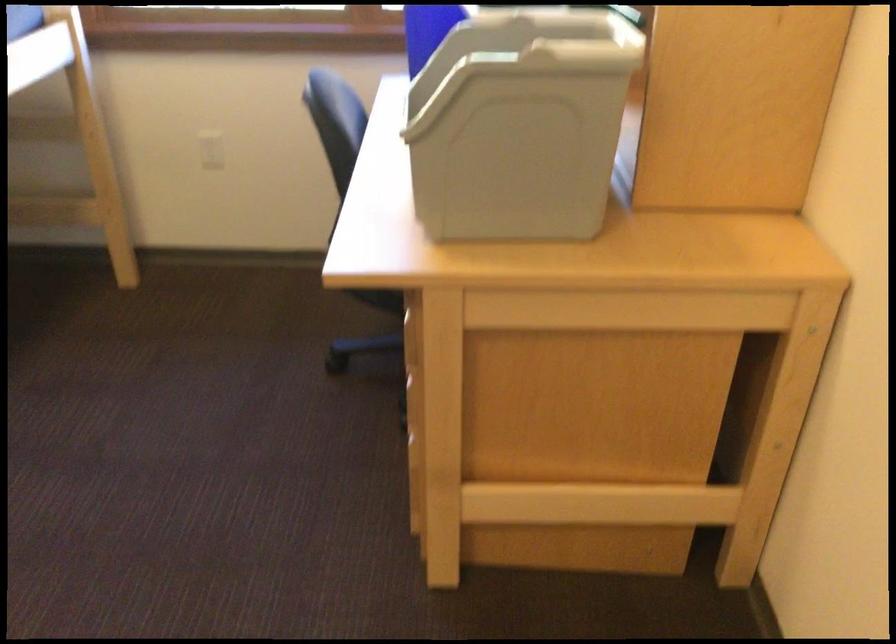
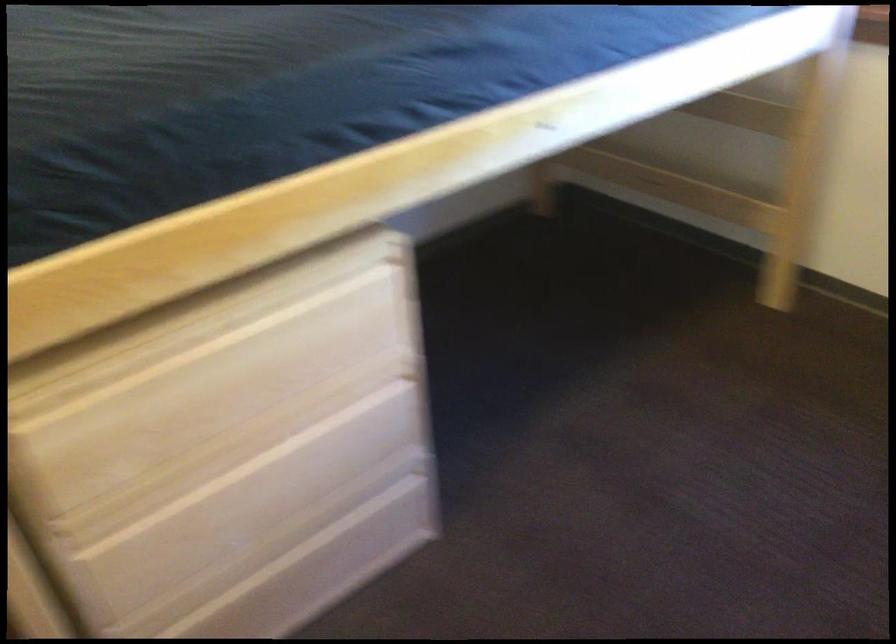
Question: The first image is from the beginning of the video and the second image is from the end. How did the camera likely rotate when shooting the video?

Choices:
 (A) Left
 (B) Right
 (C) Up
 (D) Down

Answer: (A)